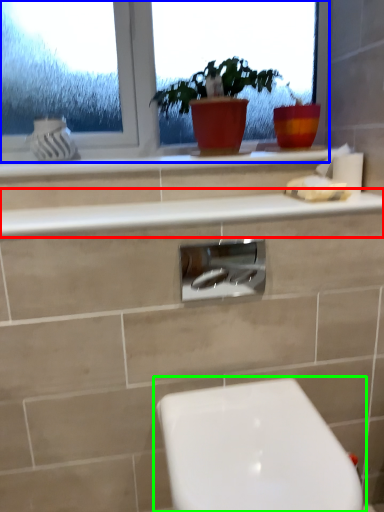
Question: Considering the real-world distances, which object is farthest from counter top (highlighted by a red box)? window (highlighted by a blue box) or toilet (highlighted by a green box)?

Choices:
 (A) window
 (B) toilet

Answer: (B)